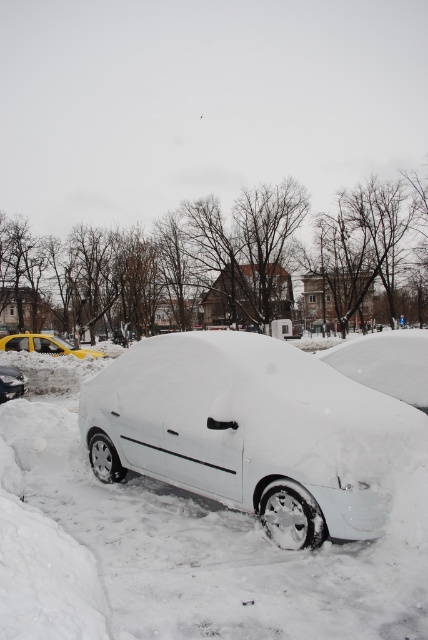
Is point (17, 340) closer to viewer compared to point (11, 368)?

No, (17, 340) is behind (11, 368).

Does yellow matte taxi at left lie behind white matte car at lower left?

Yes, yellow matte taxi at left is behind white matte car at lower left.

Is point (12, 337) behind point (17, 378)?

Yes, point (12, 337) is behind point (17, 378).

Find the location of a particular element. The height and width of the screenshot is (640, 428). yellow matte taxi at left is located at coordinates (44, 346).

Between white matte car at center and yellow matte taxi at left, which one appears on the right side from the viewer's perspective?

From the viewer's perspective, white matte car at center appears more on the right side.

Is point (163, 380) less distant than point (59, 348)?

Yes, point (163, 380) is closer to viewer.

Where is `white matte car at center`? The height and width of the screenshot is (640, 428). white matte car at center is located at coordinates (252, 433).

Find the location of `white matte car at center`. white matte car at center is located at coordinates pyautogui.click(x=252, y=433).

Which is behind, point (267, 484) or point (20, 369)?

Point (20, 369)

Image resolution: width=428 pixels, height=640 pixels. Identify the location of white matte car at center. (252, 433).